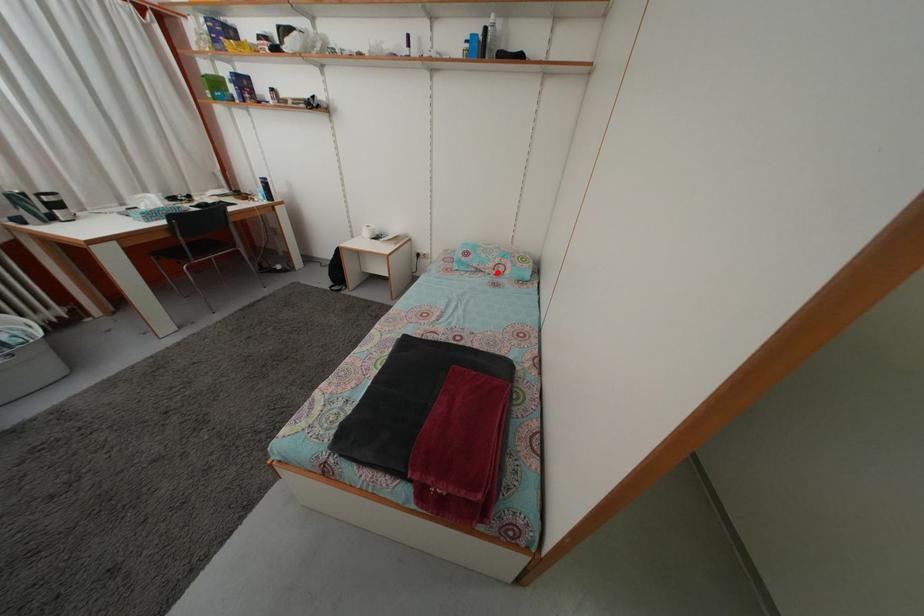
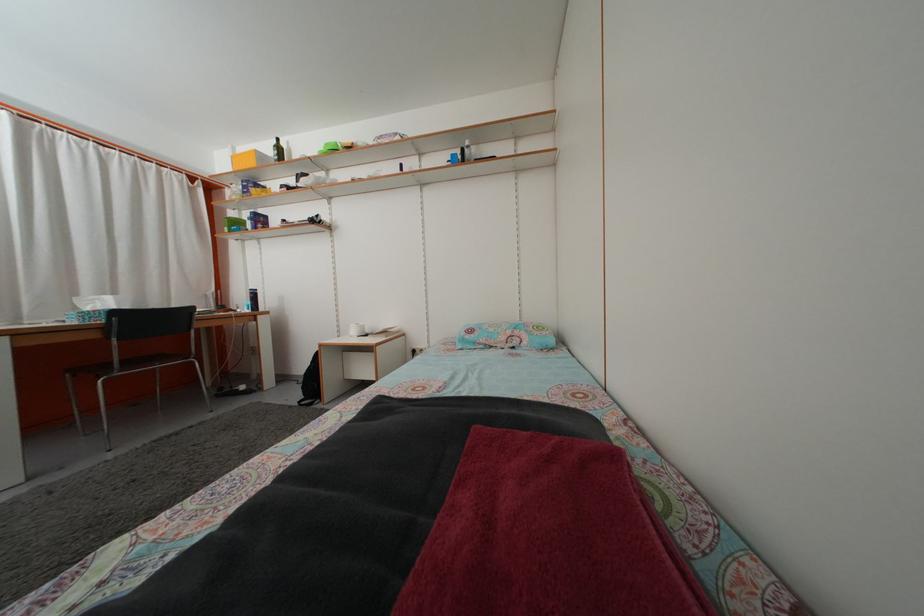
Where in the second image is the point corresponding to the highlighted location from the first image?

(508, 346)